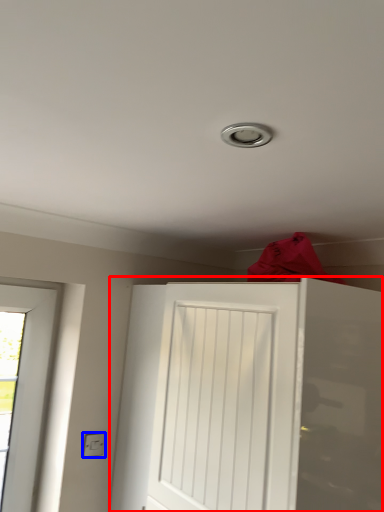
Question: Which of the following is the farthest to the observer, door (highlighted by a red box) or electric outlet (highlighted by a blue box)?

Choices:
 (A) door
 (B) electric outlet

Answer: (B)